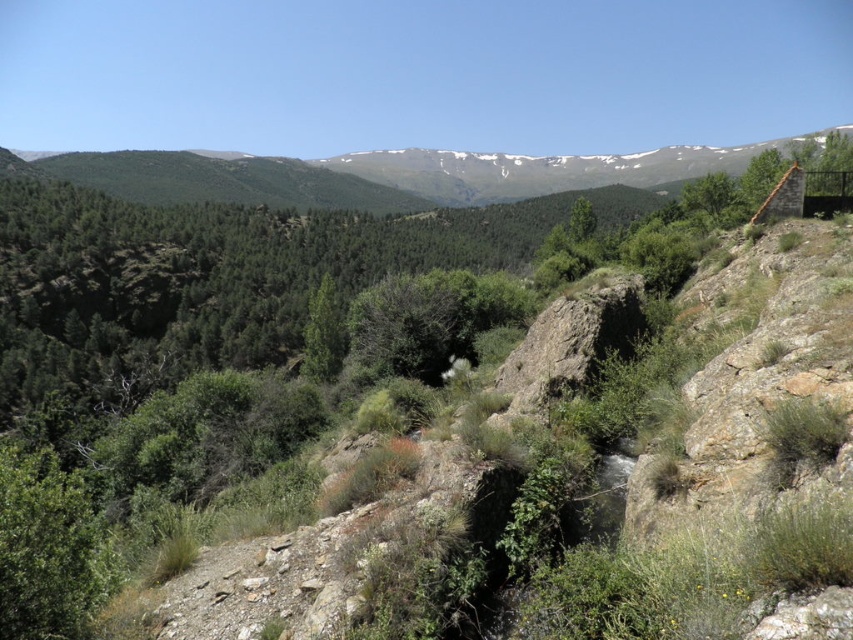
Does green forested mountain at upper center have a smaller size compared to green rough bark tree at upper right?

No, green forested mountain at upper center is not smaller than green rough bark tree at upper right.

Is point (666, 152) positioned before point (764, 177)?

That is False.

Where is `green forested mountain at upper center`? The image size is (853, 640). green forested mountain at upper center is located at coordinates (387, 173).